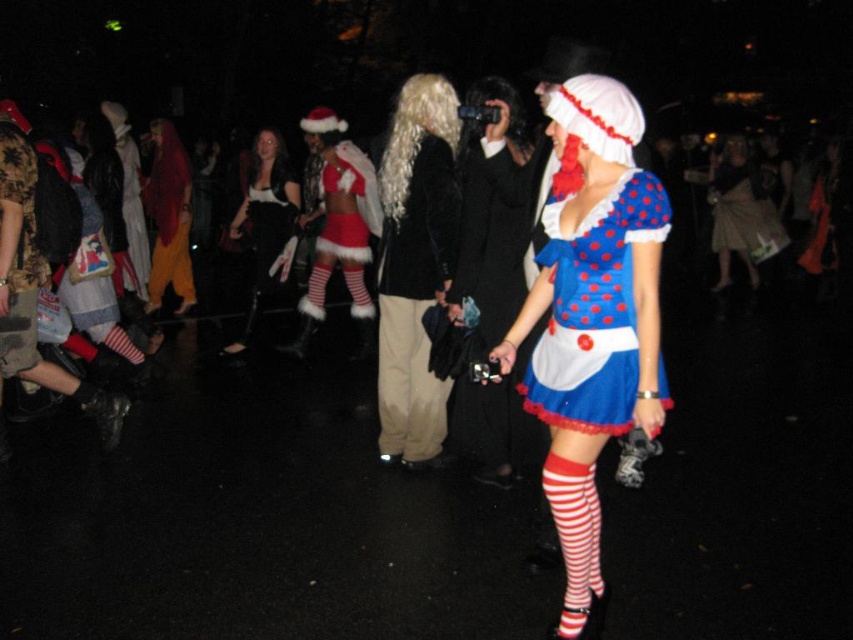
Question: Does fuzzy white santa outfit at center come in front of blonde curly wig at center?

Choices:
 (A) yes
 (B) no

Answer: (B)

Question: Can you confirm if polka dot fabric dress at center is smaller than blonde curly wig at center?

Choices:
 (A) no
 (B) yes

Answer: (B)

Question: Which of the following is the farthest from the observer?

Choices:
 (A) [x=357, y=353]
 (B) [x=189, y=253]

Answer: (B)

Question: Which object is farther from the camera taking this photo?

Choices:
 (A) polka dot fabric dress at center
 (B) matte black coat at center
 (C) beige cotton pants at center

Answer: (C)

Question: From the image, what is the correct spatial relationship of matte polka dot dress at center in relation to fuzzy white santa outfit at center?

Choices:
 (A) below
 (B) above

Answer: (A)

Question: Based on their relative distances, which object is farther from the blonde curly wig at center?

Choices:
 (A) matte polka dot dress at center
 (B) matte black coat at center
 (C) velvet black dress at center

Answer: (C)